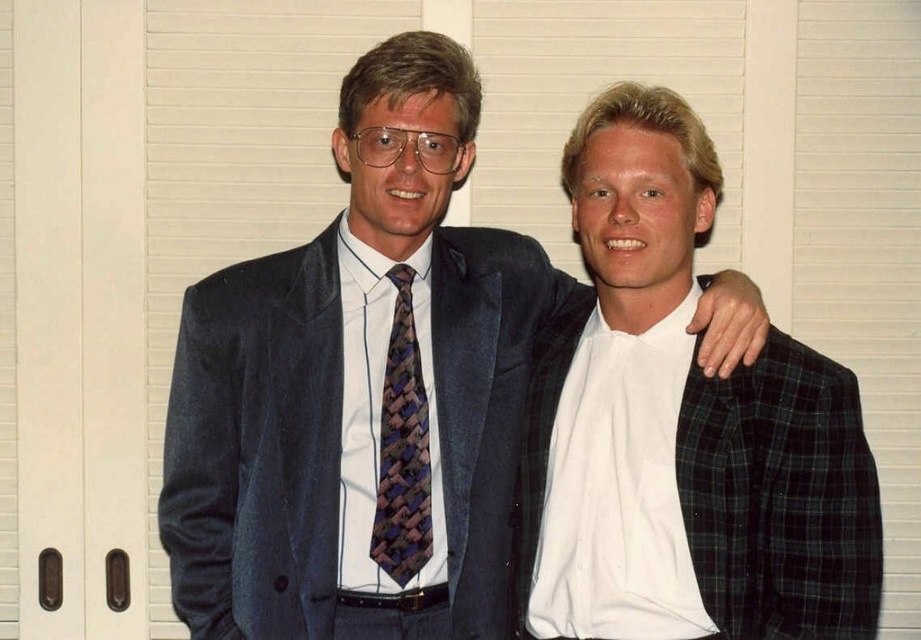
Consider the image. Can you confirm if white cotton shirt at right is taller than satin blue suit at center?

Indeed, white cotton shirt at right has a greater height compared to satin blue suit at center.

Is white cotton shirt at right above satin blue suit at center?

Yes, white cotton shirt at right is above satin blue suit at center.

Does point (848, 593) lie in front of point (334, 545)?

Yes, point (848, 593) is in front of point (334, 545).

Image resolution: width=921 pixels, height=640 pixels. I want to click on white cotton shirt at right, so click(681, 428).

Does satin blue suit at center have a greater width compared to woven silk tie at center?

Correct, the width of satin blue suit at center exceeds that of woven silk tie at center.

Measure the distance between point [467,285] and camera.

The distance of point [467,285] from camera is 2.08 meters.

Does point (327, 584) come farther from viewer compared to point (424, 518)?

No, it is not.

At what (x,y) coordinates should I click in order to perform the action: click on satin blue suit at center. Please return your answer as a coordinate pair (x, y). The width and height of the screenshot is (921, 640). Looking at the image, I should click on (255, 449).

Is white cotton shirt at right above woven silk tie at center?

Yes, white cotton shirt at right is above woven silk tie at center.

Identify the location of white cotton shirt at right. Image resolution: width=921 pixels, height=640 pixels. (681, 428).

The width and height of the screenshot is (921, 640). What do you see at coordinates (681, 428) in the screenshot?
I see `white cotton shirt at right` at bounding box center [681, 428].

Find the location of a particular element. The height and width of the screenshot is (640, 921). white cotton shirt at right is located at coordinates (681, 428).